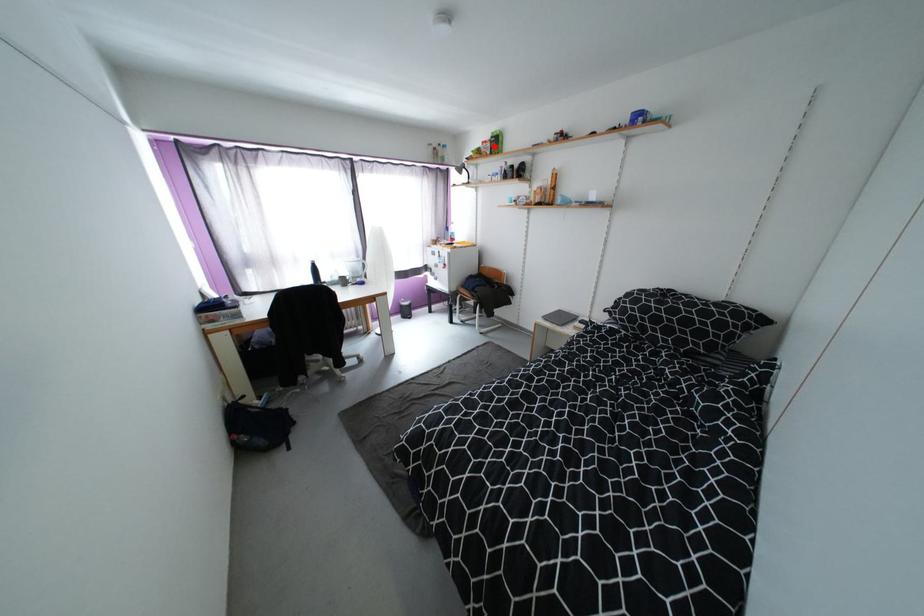
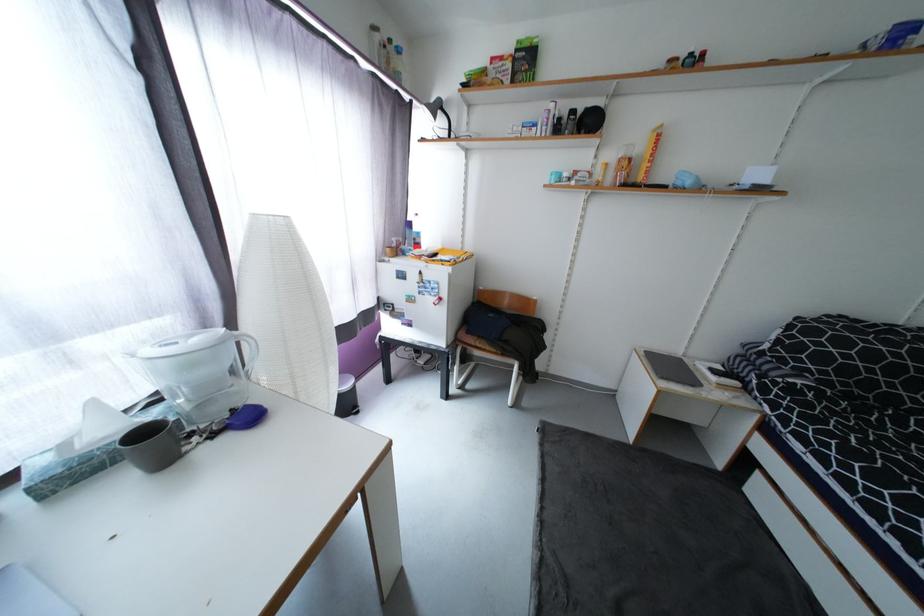
Find the pixel in the second image that matches the highlighted location in the first image.

(515, 66)